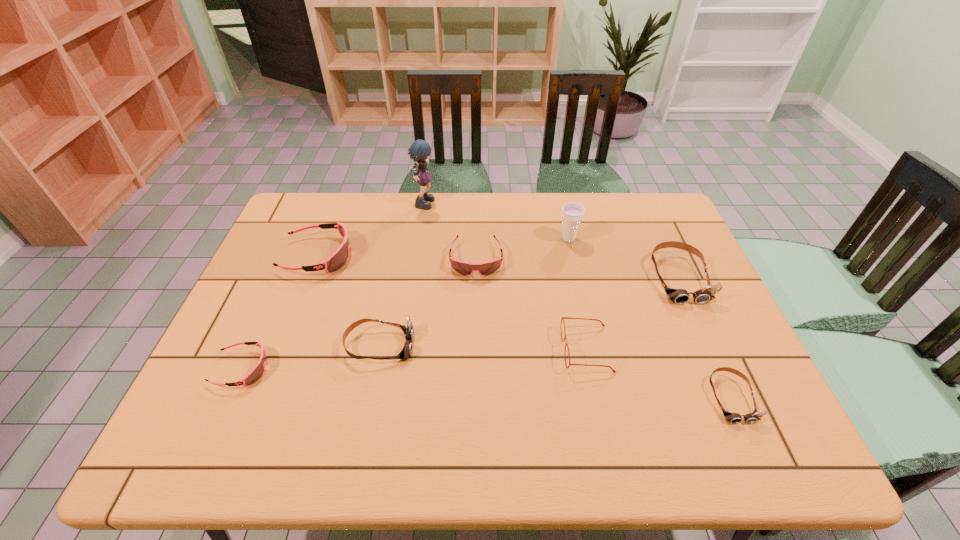
Locate an element on the screen. This screenshot has width=960, height=540. the farthest object is located at coordinates click(419, 151).

Where is `rag doll`? rag doll is located at coordinates (419, 151).

This screenshot has height=540, width=960. I want to click on the eighth shortest object, so click(x=572, y=213).

At what (x,y) coordinates should I click in order to perform the action: click on cup. Please return your answer as a coordinate pair (x, y). The width and height of the screenshot is (960, 540). Looking at the image, I should click on (572, 213).

Identify the location of the biggest pink goggles. (335, 261).

Image resolution: width=960 pixels, height=540 pixels. In order to click on the biggest brown goggles in this screenshot , I will do `click(680, 296)`.

Locate an element on the screen. the second smallest pink goggles is located at coordinates (465, 268).

Find the location of `the fourth goggles from left to right`. the fourth goggles from left to right is located at coordinates (465, 268).

You are a GUI agent. You are given a task and a screenshot of the screen. Output one action in this format:
    pyautogui.click(x=<x>, y=<y>)
    Task: Click on the second farthest brown goggles
    This screenshot has height=540, width=960.
    Given the screenshot: What is the action you would take?
    pyautogui.click(x=408, y=330)

The height and width of the screenshot is (540, 960). Find the location of `the third goggles from left to right`. the third goggles from left to right is located at coordinates (408, 330).